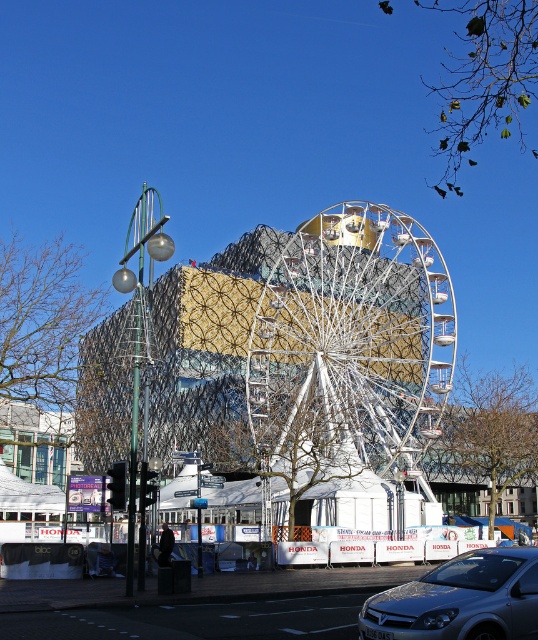
Question: Is silver metallic car at lower right thinner than white metallic wheel at center?

Choices:
 (A) yes
 (B) no

Answer: (B)

Question: Which point appears closest to the camera in this image?

Choices:
 (A) (318, 312)
 (B) (420, 595)
 (C) (501, 634)

Answer: (C)

Question: Which object is farther from the camera taking this photo?

Choices:
 (A) white metallic wheel at center
 (B) white metallic ferris wheel at center

Answer: (B)

Question: Does white metallic ferris wheel at center have a smaller size compared to silver metallic car at lower right?

Choices:
 (A) yes
 (B) no

Answer: (B)

Question: Is white metallic ferris wheel at center thinner than white metallic wheel at center?

Choices:
 (A) yes
 (B) no

Answer: (B)

Question: Which object appears farthest from the camera in this image?

Choices:
 (A) white metallic wheel at center
 (B) silver metallic car at lower right

Answer: (A)